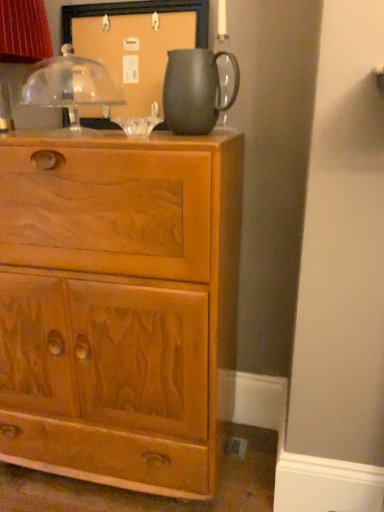
This screenshot has height=512, width=384. Find the location of `vacant space in front of matte black pitcher at upper center`. vacant space in front of matte black pitcher at upper center is located at coordinates (182, 137).